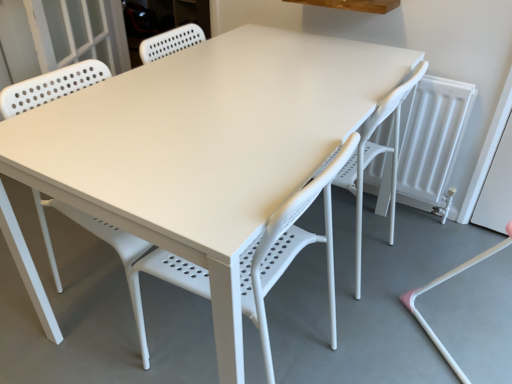
This screenshot has width=512, height=384. In order to click on free space to the right of white plastic chair at center in this screenshot , I will do `click(369, 335)`.